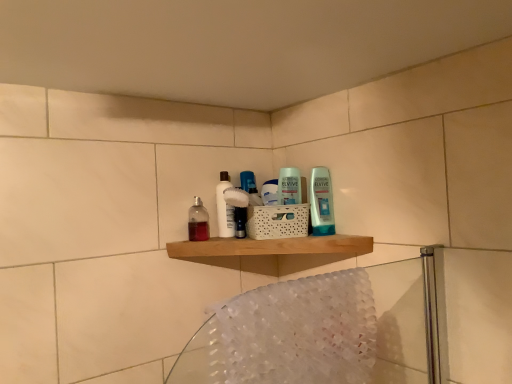
The image size is (512, 384). Describe the element at coordinates (224, 208) in the screenshot. I see `white glossy bottle at center` at that location.

What do you see at coordinates (271, 247) in the screenshot? Image resolution: width=512 pixels, height=384 pixels. I see `wooden shelf at center` at bounding box center [271, 247].

Describe the element at coordinates (300, 331) in the screenshot. This screenshot has width=512, height=384. I see `translucent fabric bath towel at lower right` at that location.

What is the approximate width of translucent plastic bottle at center?

translucent plastic bottle at center is 2.36 inches in width.

Find the location of a particular element. The width and height of the screenshot is (512, 384). white glossy bottle at center is located at coordinates (224, 208).

How different are the orientations of translucent fabric bath towel at lower right and translucent plastic bottle at center in degrees?

The facing directions of translucent fabric bath towel at lower right and translucent plastic bottle at center are 41.5 degrees apart.

Is point (322, 282) positioned in front of point (206, 238)?

Yes, it is.

Which is more to the left, translucent fabric bath towel at lower right or translucent plastic bottle at center?

translucent plastic bottle at center is more to the left.

Can you confirm if translucent fabric bath towel at lower right is smaller than translucent plastic bottle at center?

No, translucent fabric bath towel at lower right is not smaller than translucent plastic bottle at center.

Is white glossy bottle at center in contact with translucent plastic bottle at center?

Yes, white glossy bottle at center is beside translucent plastic bottle at center.

Based on the photo, considering the relative sizes of white glossy bottle at center and translucent plastic bottle at center in the image provided, is white glossy bottle at center taller than translucent plastic bottle at center?

Yes.

You are a GUI agent. You are given a task and a screenshot of the screen. Output one action in this format:
    pyautogui.click(x=<x>, y=<y>)
    Task: Click on the mouthwash that appears below the white glossy bottle at center (from a real-world perspective)
    This screenshot has width=512, height=384.
    Given the screenshot: What is the action you would take?
    pyautogui.click(x=198, y=221)

From the picture: Is white glossy bottle at center turned away from translucent plastic bottle at center?

No, white glossy bottle at center's orientation is not away from translucent plastic bottle at center.

Which of these two, white glossy bottle at center or wooden shelf at center, is thinner?

white glossy bottle at center is thinner.

From a real-world perspective, is white glossy bottle at center located higher than wooden shelf at center?

Yes.

From the image's perspective, between white glossy bottle at center and wooden shelf at center, which one is located above?

white glossy bottle at center appears higher in the image.

In terms of height, does wooden shelf at center look taller or shorter compared to translucent fabric bath towel at lower right?

wooden shelf at center is shorter than translucent fabric bath towel at lower right.

From the image's perspective, does wooden shelf at center appear higher than translucent fabric bath towel at lower right?

Yes, from the image's perspective, wooden shelf at center is on top of translucent fabric bath towel at lower right.

Does point (183, 248) appear closer or farther from the camera than point (276, 321)?

Point (183, 248).

Does translucent fabric bath towel at lower right turn towards white glossy bottle at center?

No, translucent fabric bath towel at lower right is not facing towards white glossy bottle at center.

Between translucent fabric bath towel at lower right and white glossy bottle at center, which one is positioned behind?

white glossy bottle at center is further from the camera.

Is white glossy bottle at center inside translucent fabric bath towel at lower right?

No, white glossy bottle at center is not surrounded by translucent fabric bath towel at lower right.

From a real-world perspective, which object stands above the other?

From a 3D spatial view, white glossy bottle at center is above.

Does translucent plastic bottle at center come behind white glossy bottle at center?

That is False.

Can you confirm if translucent plastic bottle at center is taller than white glossy bottle at center?

Incorrect, the height of translucent plastic bottle at center is not larger of that of white glossy bottle at center.

Which is more distant, (196, 228) or (222, 199)?

Point (196, 228)

In the scene shown: Between translucent plastic bottle at center and white glossy bottle at center, which one has smaller width?

With smaller width is white glossy bottle at center.

What are the coordinates of `bath towel lying on the right of translucent plastic bottle at center` in the screenshot? It's located at (300, 331).

In the image, is translucent plastic bottle at center positioned in front of or behind translucent fabric bath towel at lower right?

translucent plastic bottle at center is positioned farther from the viewer than translucent fabric bath towel at lower right.

From a real-world perspective, is translucent plastic bottle at center over translucent fabric bath towel at lower right?

Indeed, from a real-world perspective, translucent plastic bottle at center stands above translucent fabric bath towel at lower right.

Is there a large distance between translucent plastic bottle at center and translucent fabric bath towel at lower right?

No, there isn't a large distance between translucent plastic bottle at center and translucent fabric bath towel at lower right.

Image resolution: width=512 pixels, height=384 pixels. Find the location of `mouthwash behind the translucent fabric bath towel at lower right`. mouthwash behind the translucent fabric bath towel at lower right is located at coordinates (198, 221).

The height and width of the screenshot is (384, 512). Find the location of `mouthwash in front of the white glossy bottle at center`. mouthwash in front of the white glossy bottle at center is located at coordinates (198, 221).

From the image, which object appears to be nearer to white glossy bottle at center, translucent fabric bath towel at lower right or wooden shelf at center?

Based on the image, wooden shelf at center appears to be nearer to white glossy bottle at center.

When comparing their distances from wooden shelf at center, does translucent plastic bottle at center or translucent fabric bath towel at lower right seem further?

translucent fabric bath towel at lower right.

Considering their positions, is wooden shelf at center positioned closer to white glossy bottle at center than translucent plastic bottle at center?

translucent plastic bottle at center is positioned closer to the anchor white glossy bottle at center.

From the image, which object appears to be nearer to translucent plastic bottle at center, wooden shelf at center or white glossy bottle at center?

The object closer to translucent plastic bottle at center is white glossy bottle at center.

When comparing their distances from white glossy bottle at center, does translucent plastic bottle at center or wooden shelf at center seem further?

wooden shelf at center lies further to white glossy bottle at center than the other object.

Which object lies further to the anchor point wooden shelf at center, white glossy bottle at center or translucent plastic bottle at center?

Among the two, translucent plastic bottle at center is located further to wooden shelf at center.

From the image, which object appears to be farther from translucent fabric bath towel at lower right, white glossy bottle at center or translucent plastic bottle at center?

translucent plastic bottle at center is further to translucent fabric bath towel at lower right.

Which object lies further to the anchor point wooden shelf at center, translucent fabric bath towel at lower right or translucent plastic bottle at center?

translucent fabric bath towel at lower right is positioned further to the anchor wooden shelf at center.

This screenshot has height=384, width=512. In order to click on mouthwash positioned between wooden shelf at center and white glossy bottle at center from near to far in this screenshot , I will do `click(198, 221)`.

Where is `mouthwash located between translucent fabric bath towel at lower right and white glossy bottle at center in the depth direction`? This screenshot has height=384, width=512. mouthwash located between translucent fabric bath towel at lower right and white glossy bottle at center in the depth direction is located at coordinates (198, 221).

At what (x,y) coordinates should I click in order to perform the action: click on shelf between translucent fabric bath towel at lower right and white glossy bottle at center from front to back. Please return your answer as a coordinate pair (x, y). Looking at the image, I should click on (271, 247).

This screenshot has height=384, width=512. Find the location of `shelf between translucent fabric bath towel at lower right and translucent plastic bottle at center in the front-back direction`. shelf between translucent fabric bath towel at lower right and translucent plastic bottle at center in the front-back direction is located at coordinates (271, 247).